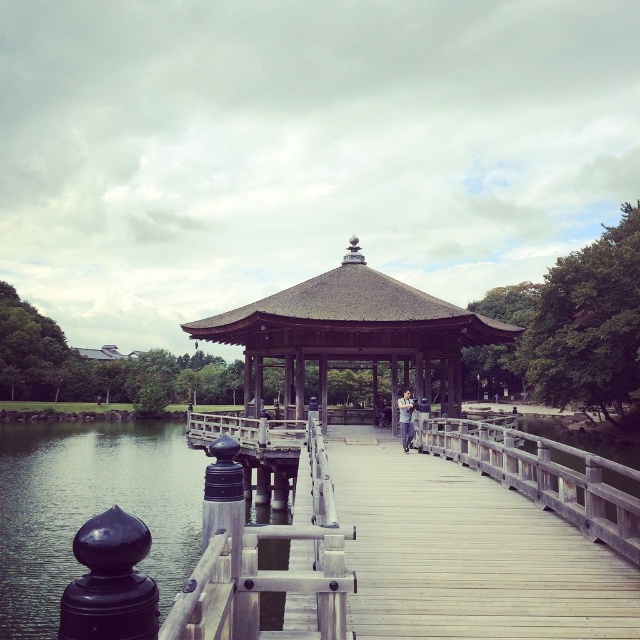
Based on the photo, you are standing at the origin point of the coordinate system in the scene. The brown wooden gazebo at center is marked at a specific coordinate. Can you determine the direction you need to move to reach the gazebo?

The brown wooden gazebo at center is located at coordinates approximately 0.519 on the x and 0.547 on the y axis. Since the origin point is at the bottom left corner of the scene, moving towards the center would involve moving right along the x axis and up along the y axis to reach the gazebo.

You are a visitor standing at the entrance of the wooden bridge. You notice the brown wooden gazebo at center and the wooden at center. Which structure is taller?

The brown wooden gazebo at center is taller than the wooden at center.